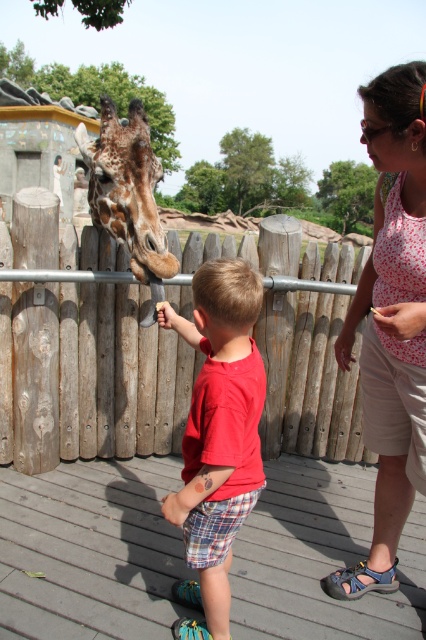
Question: From the image, what is the correct spatial relationship of wooden fence at center in relation to red cotton shirt at center?

Choices:
 (A) right
 (B) left

Answer: (A)

Question: From the image, what is the correct spatial relationship of wooden fence at center in relation to floral tank top at center?

Choices:
 (A) above
 (B) below

Answer: (B)

Question: Estimate the real-world distances between objects in this image. Which object is farther from the red cotton shirt at center?

Choices:
 (A) brown spotted fur at center
 (B) floral tank top at center
 (C) wooden fence at center

Answer: (C)

Question: Which point appears closest to the camera in this image?

Choices:
 (A) (241, 476)
 (B) (380, 420)

Answer: (A)

Question: Which of the following is the farthest from the observer?

Choices:
 (A) (81, 424)
 (B) (399, 356)
 (C) (204, 433)

Answer: (A)

Question: Can you confirm if wooden fence at center is smaller than red cotton shirt at center?

Choices:
 (A) yes
 (B) no

Answer: (B)